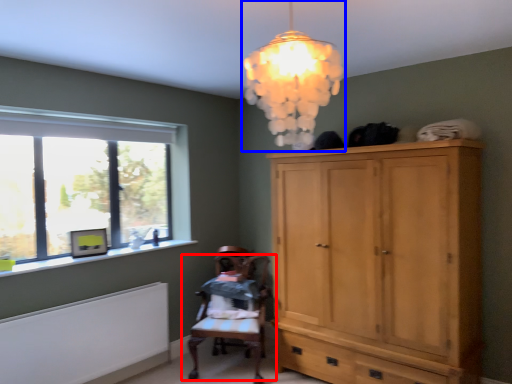
Question: Which of the following is the farthest to the observer, chair (highlighted by a red box) or lamp (highlighted by a blue box)?

Choices:
 (A) chair
 (B) lamp

Answer: (A)